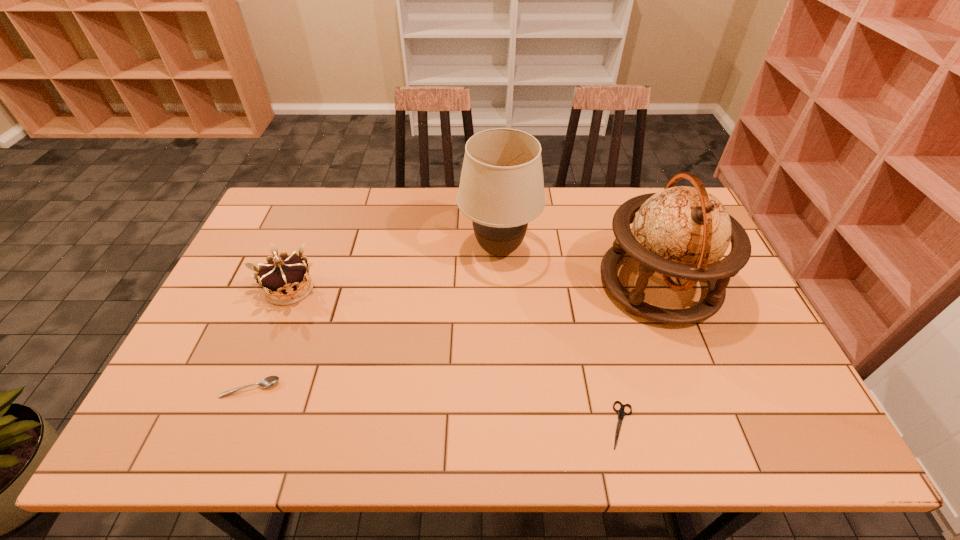
Identify the location of the third object from right to left. This screenshot has width=960, height=540. click(x=501, y=190).

Where is `the rightmost object`? Image resolution: width=960 pixels, height=540 pixels. the rightmost object is located at coordinates (683, 232).

I want to click on the third shortest object, so click(x=285, y=279).

The image size is (960, 540). In order to click on the second shortest object in this screenshot , I will do `click(269, 381)`.

Identify the location of soupspoon. (269, 381).

Identify the location of the nearest object. (621, 413).

Identify the location of the shortest object. (621, 413).

Image resolution: width=960 pixels, height=540 pixels. I want to click on free location located 0.190m on the front of the lampshade, so click(503, 330).

You are a GUI agent. You are given a task and a screenshot of the screen. Output one action in this format:
    pyautogui.click(x=<x>, y=<y>)
    Task: Click on the vacant space located 0.320m on the front of the globe
    
    Given the screenshot: What is the action you would take?
    pyautogui.click(x=724, y=451)

You are a GUI agent. You are given a task and a screenshot of the screen. Output one action in this format:
    pyautogui.click(x=<x>, y=<y>)
    Task: Click on the free space located on the back of the crown
    This screenshot has height=540, width=960.
    Given the screenshot: What is the action you would take?
    pyautogui.click(x=328, y=194)